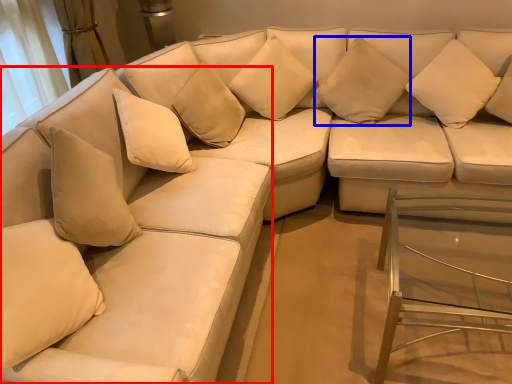
Question: Which object is further to the camera taking this photo, couch (highlighted by a red box) or pillow (highlighted by a blue box)?

Choices:
 (A) couch
 (B) pillow

Answer: (B)